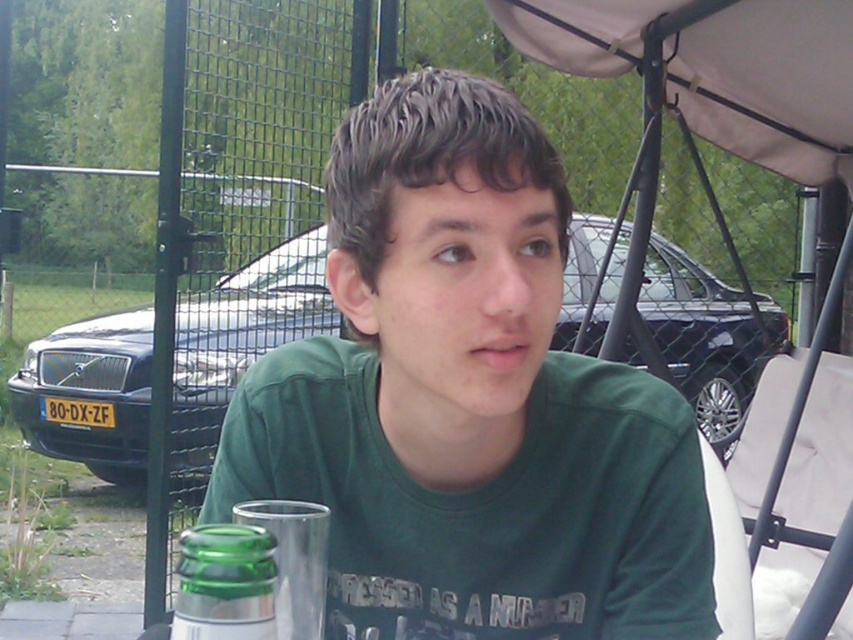
Question: Can you confirm if green matte shirt at center is positioned to the left of green glass bottle at lower left?

Choices:
 (A) no
 (B) yes

Answer: (A)

Question: Observing the image, what is the correct spatial positioning of green matte shirt at center in reference to green glass bottle at lower left?

Choices:
 (A) left
 (B) right

Answer: (B)

Question: Is green matte shirt at center to the left of green glass bottle at lower left from the viewer's perspective?

Choices:
 (A) no
 (B) yes

Answer: (A)

Question: Among these objects, which one is nearest to the camera?

Choices:
 (A) green glass bottle at lower left
 (B) green matte shirt at center

Answer: (A)

Question: Which object is farther from the camera taking this photo?

Choices:
 (A) green matte shirt at center
 (B) green glass bottle at lower left

Answer: (A)